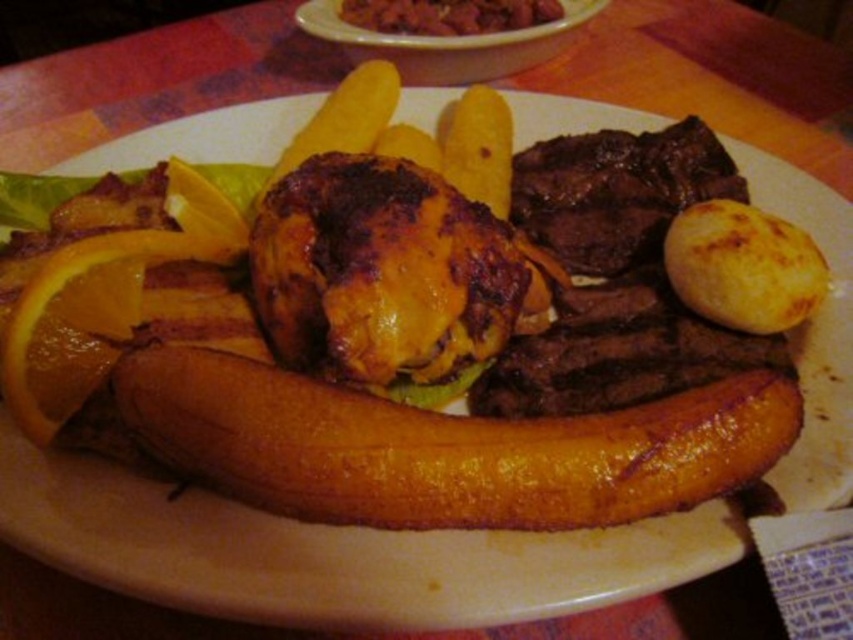
Question: Estimate the real-world distances between objects in this image. Which object is closer to the brown crispy meat at upper center?

Choices:
 (A) brown crispy beef at center
 (B) golden brown baked potato at right

Answer: (A)

Question: Which object is farther from the camera taking this photo?

Choices:
 (A) golden brown baked potato at right
 (B) brown crispy meat at upper center
 (C) brown crispy beef at center

Answer: (B)

Question: Is golden brown baked potato at right smaller than brown crispy meat at upper center?

Choices:
 (A) yes
 (B) no

Answer: (B)

Question: Considering the relative positions of brown crispy beef at center and brown crispy meat at upper center in the image provided, where is brown crispy beef at center located with respect to brown crispy meat at upper center?

Choices:
 (A) right
 (B) left

Answer: (B)

Question: From the image, what is the correct spatial relationship of golden brown baked potato at right in relation to brown crispy meat at upper center?

Choices:
 (A) right
 (B) left

Answer: (A)

Question: Estimate the real-world distances between objects in this image. Which object is closer to the brown crispy meat at upper center?

Choices:
 (A) golden brown baked potato at right
 (B) brown crispy beef at center

Answer: (B)